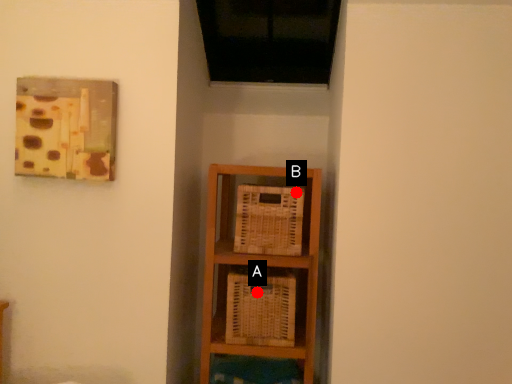
Question: Two points are circled on the image, labeled by A and B beside each circle. Which point is further to the camera?

Choices:
 (A) A is further
 (B) B is further

Answer: (A)